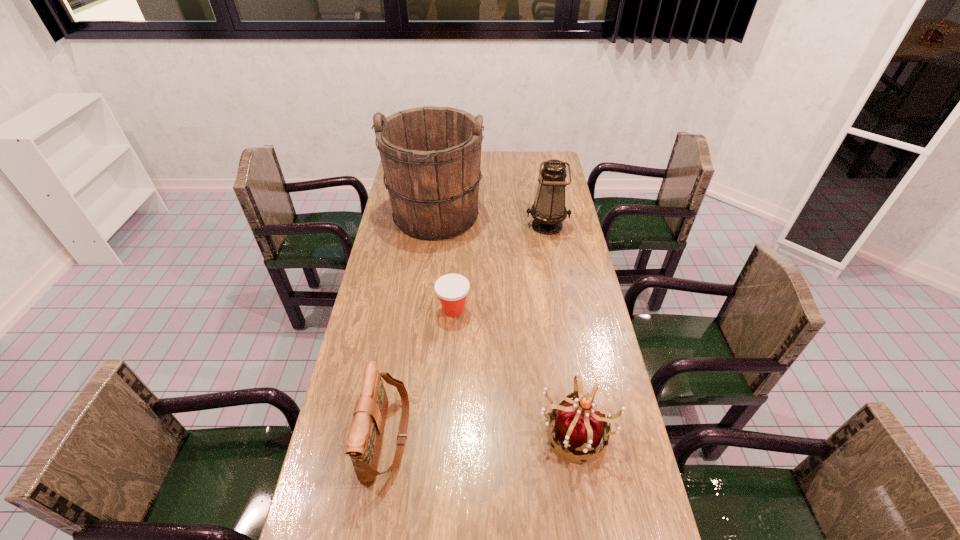
I want to click on the tallest object, so click(x=431, y=156).

You are a GUI agent. You are given a task and a screenshot of the screen. Output one action in this format:
    pyautogui.click(x=<x>, y=<y>)
    Task: Click on the oil lamp
    
    Given the screenshot: What is the action you would take?
    pyautogui.click(x=548, y=211)

You are a GUI agent. You are given a task and a screenshot of the screen. Output one action in this format:
    pyautogui.click(x=<x>, y=<y>)
    Task: Click on the tiara
    
    Given the screenshot: What is the action you would take?
    pyautogui.click(x=579, y=425)

In order to click on shoulder bag in this screenshot , I will do `click(365, 436)`.

Where is `Dixie cup`? Dixie cup is located at coordinates (452, 289).

Locate an element on the screen. the shortest object is located at coordinates (452, 289).

Where is `vacant space located 0.100m on the back of the bucket`? vacant space located 0.100m on the back of the bucket is located at coordinates (440, 177).

Find the location of `vacant region located 0.380m on the front of the second tallest object`. vacant region located 0.380m on the front of the second tallest object is located at coordinates (562, 307).

The image size is (960, 540). I want to click on blank space located 0.140m on the front-facing side of the tiara, so click(x=591, y=528).

This screenshot has height=540, width=960. I want to click on free region located 0.070m on the front-facing side of the shoulder bag, so click(x=434, y=436).